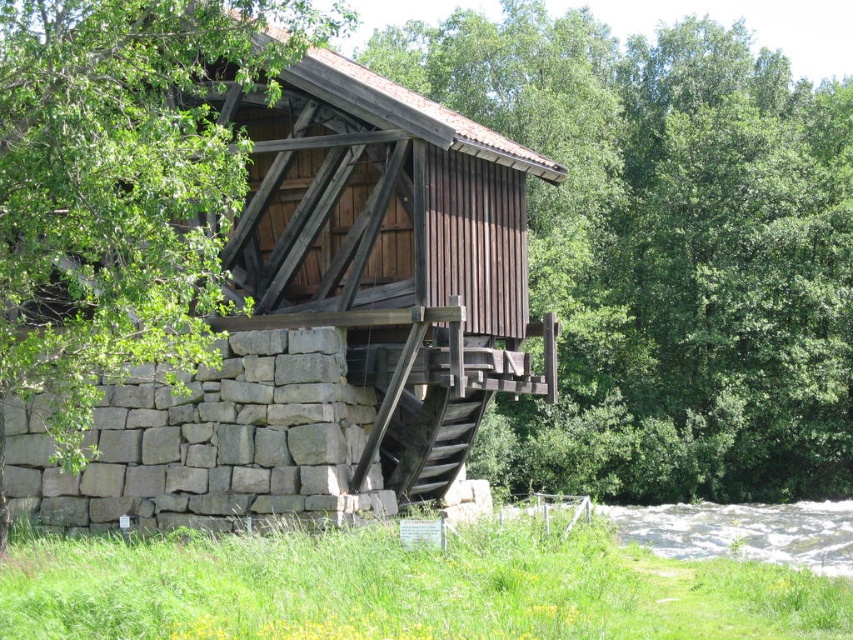
Can you confirm if brown wood tree at center is bigger than white frothy water at lower right?

Yes.

Can you confirm if brown wood tree at center is smaller than white frothy water at lower right?

No, brown wood tree at center is not smaller than white frothy water at lower right.

The width and height of the screenshot is (853, 640). Identify the location of brown wood tree at center. (665, 252).

In the scene shown: Who is more forward, (741, 268) or (257, 246)?

Point (257, 246) is more forward.

Can you confirm if brown wood tree at center is positioned to the left of brown wooden hut at center?

Incorrect, brown wood tree at center is not on the left side of brown wooden hut at center.

Measure the distance between brown wood tree at center and camera.

brown wood tree at center and camera are 49.23 meters apart from each other.

Image resolution: width=853 pixels, height=640 pixels. What are the coordinates of `brown wood tree at center` in the screenshot? It's located at (665, 252).

From the picture: Is brown wooden hut at center to the left of white frothy water at lower right from the viewer's perspective?

Indeed, brown wooden hut at center is positioned on the left side of white frothy water at lower right.

Between point (466, 227) and point (717, 531), which one is positioned in front?

Point (466, 227)

The width and height of the screenshot is (853, 640). Find the location of `brown wooden hut at center`. brown wooden hut at center is located at coordinates (332, 317).